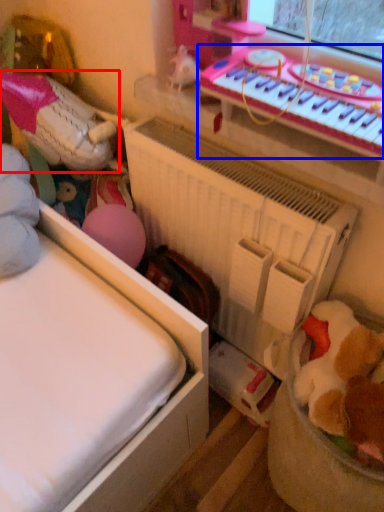
Question: Which object appears farthest to the camera in this image, toy (highlighted by a red box) or musical keyboard (highlighted by a blue box)?

Choices:
 (A) toy
 (B) musical keyboard

Answer: (A)